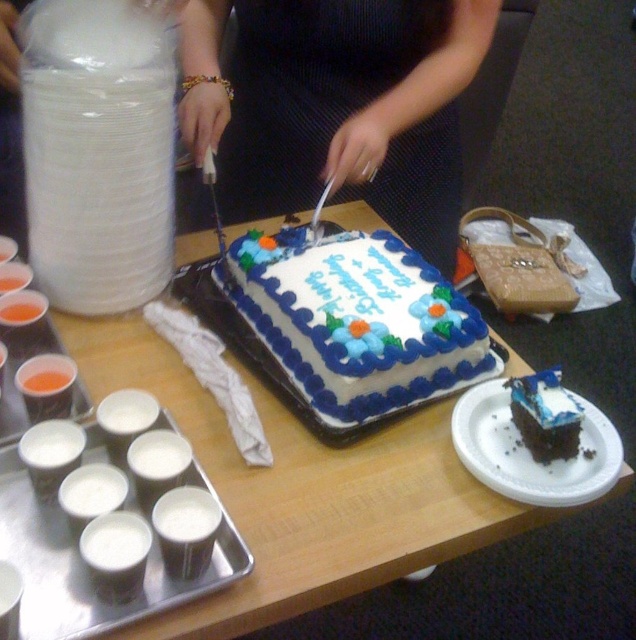
Who is positioned more to the right, white cardboard cake at center or chocolate cake at lower right?

chocolate cake at lower right is more to the right.

Looking at this image, is white cardboard cake at center closer to the viewer compared to chocolate cake at lower right?

Yes, white cardboard cake at center is in front of chocolate cake at lower right.

What do you see at coordinates (300, 490) in the screenshot? I see `white cardboard cake at center` at bounding box center [300, 490].

In order to click on white cardboard cake at center in this screenshot , I will do `click(300, 490)`.

Does matte black dress at center appear on the left side of chocolate cake at lower right?

Yes, matte black dress at center is to the left of chocolate cake at lower right.

Between matte black dress at center and chocolate cake at lower right, which one has less height?

chocolate cake at lower right

Identify the location of matte black dress at center. (336, 106).

Is chocolate cake at lower right shorter than chocolate cake at center?

Incorrect, chocolate cake at lower right's height does not fall short of chocolate cake at center's.

Is the position of chocolate cake at lower right less distant than that of chocolate cake at center?

Yes, it is.

Which is behind, point (515, 483) or point (543, 428)?

The point (543, 428) is more distant.

At what (x,y) coordinates should I click in order to perform the action: click on chocolate cake at lower right. Please return your answer as a coordinate pair (x, y). The height and width of the screenshot is (640, 636). Looking at the image, I should click on (529, 452).